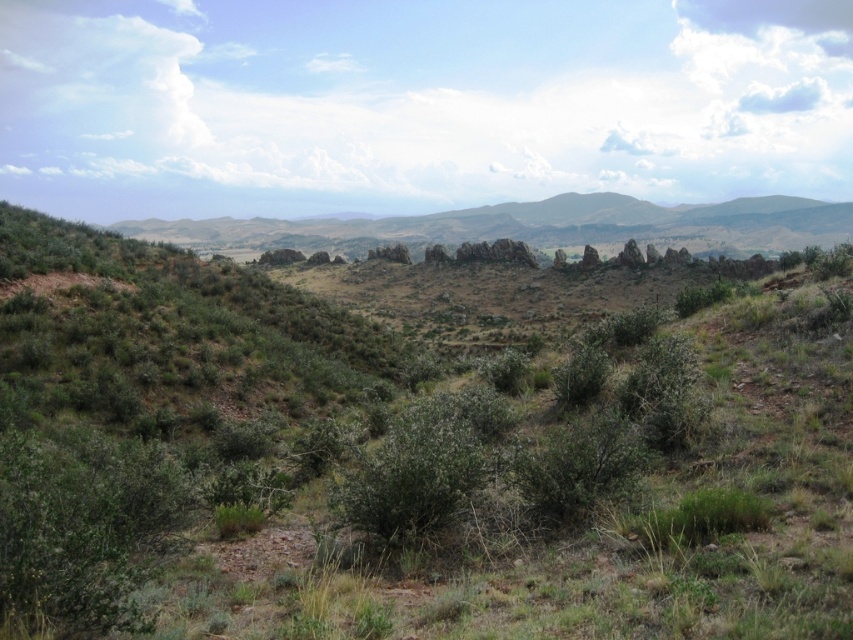
Question: Is green shrubbery at center to the right of green grassy mountain at center from the viewer's perspective?

Choices:
 (A) no
 (B) yes

Answer: (B)

Question: Where is green shrubbery at center located in relation to green grassy mountain at center in the image?

Choices:
 (A) below
 (B) above

Answer: (A)

Question: Does green shrubbery at center appear on the right side of green grassy mountain at center?

Choices:
 (A) yes
 (B) no

Answer: (A)

Question: Among these points, which one is nearest to the camera?

Choices:
 (A) (276, 369)
 (B) (503, 227)

Answer: (A)